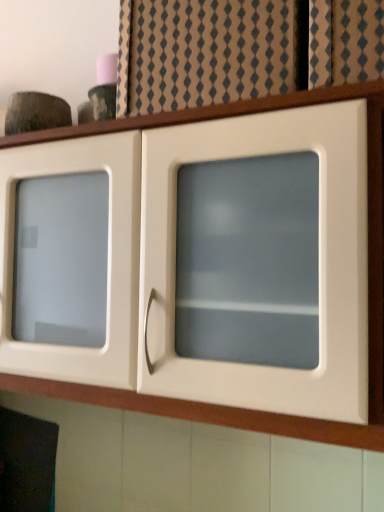
The image size is (384, 512). What do you see at coordinates (368, 284) in the screenshot?
I see `white glossy cabinet at upper center` at bounding box center [368, 284].

Locate an element on the screen. Image resolution: width=384 pixels, height=512 pixels. white glossy cabinet at upper center is located at coordinates (368, 284).

Measure the distance between beige textured fabric at upper center and camera.

25.55 inches.

The height and width of the screenshot is (512, 384). What do you see at coordinates (204, 53) in the screenshot?
I see `beige textured fabric at upper center` at bounding box center [204, 53].

Find the location of a particular element. The width and height of the screenshot is (384, 512). beige textured fabric at upper center is located at coordinates (204, 53).

At what (x,y) coordinates should I click in order to perform the action: click on white glossy cabinet at upper center. Please return your answer as a coordinate pair (x, y). This screenshot has width=384, height=512. Looking at the image, I should click on (368, 284).

Can you confirm if beige textured fabric at upper center is positioned to the right of white glossy cabinet at upper center?

Yes.

Does beige textured fabric at upper center come in front of white glossy cabinet at upper center?

No, beige textured fabric at upper center is further to the viewer.

Considering the points (223, 35) and (206, 408), which point is behind, point (223, 35) or point (206, 408)?

The point (223, 35) is farther from the camera.

From the image's perspective, between beige textured fabric at upper center and white glossy cabinet at upper center, which one is located above?

beige textured fabric at upper center, from the image's perspective.

From a real-world perspective, is beige textured fabric at upper center on top of white glossy cabinet at upper center?

Correct, in the physical world, beige textured fabric at upper center is higher than white glossy cabinet at upper center.

Considering the sizes of beige textured fabric at upper center and white glossy cabinet at upper center in the image, is beige textured fabric at upper center wider or thinner than white glossy cabinet at upper center?

In the image, beige textured fabric at upper center appears to be more narrow than white glossy cabinet at upper center.

Which of these two, beige textured fabric at upper center or white glossy cabinet at upper center, stands shorter?

Standing shorter between the two is beige textured fabric at upper center.

Consider the image. Can you confirm if beige textured fabric at upper center is bigger than white glossy cabinet at upper center?

Incorrect, beige textured fabric at upper center is not larger than white glossy cabinet at upper center.

Is beige textured fabric at upper center located outside white glossy cabinet at upper center?

Absolutely, beige textured fabric at upper center is external to white glossy cabinet at upper center.

Are beige textured fabric at upper center and white glossy cabinet at upper center making contact?

beige textured fabric at upper center and white glossy cabinet at upper center are clearly separated.

Does beige textured fabric at upper center turn towards white glossy cabinet at upper center?

No, beige textured fabric at upper center is not facing towards white glossy cabinet at upper center.

Locate an element on the screen. This screenshot has height=512, width=384. cupboard below the beige textured fabric at upper center (from a real-world perspective) is located at coordinates (368, 284).

Considering the positions of objects white glossy cabinet at upper center and beige textured fabric at upper center in the image provided, who is more to the right, white glossy cabinet at upper center or beige textured fabric at upper center?

beige textured fabric at upper center is more to the right.

Which object is closer to the camera taking this photo, white glossy cabinet at upper center or beige textured fabric at upper center?

white glossy cabinet at upper center.

Is point (376, 149) positioned in front of point (286, 54)?

Yes, point (376, 149) is in front of point (286, 54).

From the image's perspective, is white glossy cabinet at upper center above beige textured fabric at upper center?

Actually, white glossy cabinet at upper center appears below beige textured fabric at upper center in the image.

From a real-world perspective, is white glossy cabinet at upper center below beige textured fabric at upper center?

Indeed, from a real-world perspective, white glossy cabinet at upper center is positioned beneath beige textured fabric at upper center.

Is white glossy cabinet at upper center wider or thinner than beige textured fabric at upper center?

white glossy cabinet at upper center is wider than beige textured fabric at upper center.

Is white glossy cabinet at upper center shorter than beige textured fabric at upper center?

No, white glossy cabinet at upper center is not shorter than beige textured fabric at upper center.

Is white glossy cabinet at upper center smaller than beige textured fabric at upper center?

Incorrect, white glossy cabinet at upper center is not smaller in size than beige textured fabric at upper center.

Would you say white glossy cabinet at upper center contains beige textured fabric at upper center?

No, beige textured fabric at upper center is not a part of white glossy cabinet at upper center.

Is white glossy cabinet at upper center placed right next to beige textured fabric at upper center?

No, white glossy cabinet at upper center is not touching beige textured fabric at upper center.

Could you tell me if white glossy cabinet at upper center is turned towards beige textured fabric at upper center?

No, white glossy cabinet at upper center is not facing towards beige textured fabric at upper center.

What's the angular difference between white glossy cabinet at upper center and beige textured fabric at upper center's facing directions?

They differ by 1.4 degrees in their facing directions.

Measure the distance from white glossy cabinet at upper center to beige textured fabric at upper center.

white glossy cabinet at upper center and beige textured fabric at upper center are 6.52 inches apart.

In the image, there is a beige textured fabric at upper center. At what (x,y) coordinates should I click in order to perform the action: click on cupboard below it (from the image's perspective). Please return your answer as a coordinate pair (x, y). This screenshot has height=512, width=384. Looking at the image, I should click on (368, 284).

At what (x,y) coordinates should I click in order to perform the action: click on curtain that appears on the right of white glossy cabinet at upper center. Please return your answer as a coordinate pair (x, y). Looking at the image, I should click on (204, 53).

At what (x,y) coordinates should I click in order to perform the action: click on curtain lying above the white glossy cabinet at upper center (from the image's perspective). Please return your answer as a coordinate pair (x, y). The height and width of the screenshot is (512, 384). Looking at the image, I should click on (204, 53).